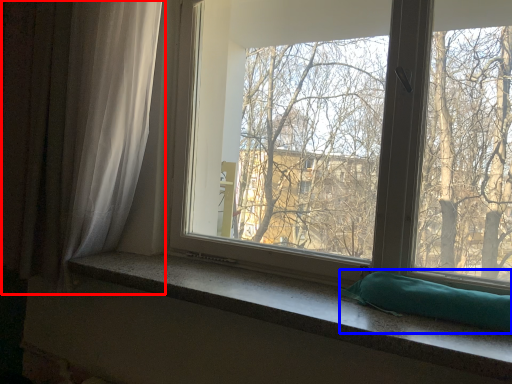
Question: Which object is further to the camera taking this photo, curtain (highlighted by a red box) or pillow (highlighted by a blue box)?

Choices:
 (A) curtain
 (B) pillow

Answer: (A)